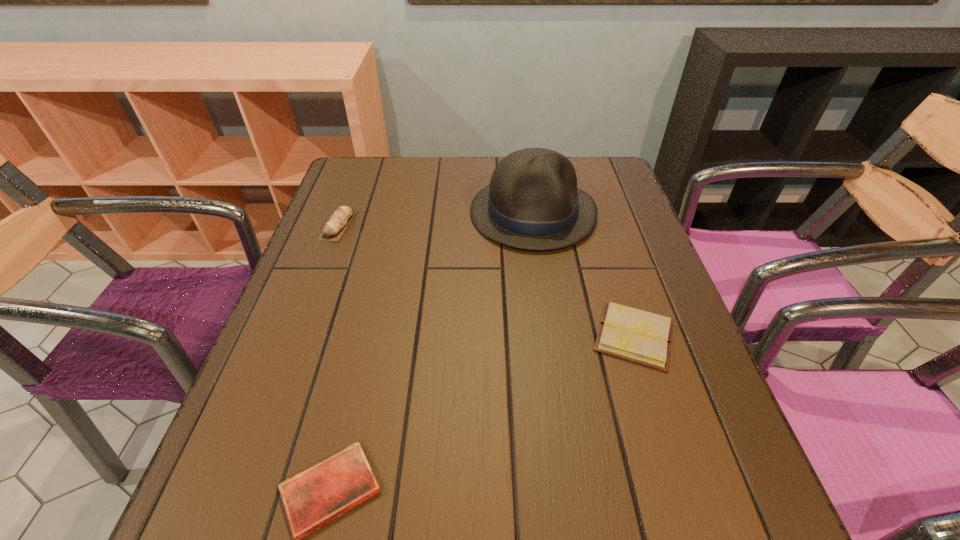
In order to click on bowler hat in this screenshot , I will do `click(532, 202)`.

The height and width of the screenshot is (540, 960). I want to click on the leftmost object, so click(x=333, y=230).

This screenshot has height=540, width=960. I want to click on pita bread, so click(333, 230).

In order to click on the second nearest object in this screenshot , I will do `click(635, 335)`.

Where is `the right diary`? This screenshot has height=540, width=960. the right diary is located at coordinates tap(635, 335).

You are a GUI agent. You are given a task and a screenshot of the screen. Output one action in this format:
    pyautogui.click(x=<x>, y=<y>)
    Task: Click on the free space located 0.330m on the front-facing side of the tallest object
    
    Given the screenshot: What is the action you would take?
    pyautogui.click(x=557, y=375)

Locate an element on the screen. Image resolution: width=960 pixels, height=540 pixels. free region located 0.130m on the back of the second tallest object is located at coordinates (355, 182).

This screenshot has height=540, width=960. I want to click on vacant area located 0.210m on the left of the right diary, so click(482, 335).

The width and height of the screenshot is (960, 540). In order to click on object at the far edge in this screenshot , I will do `click(532, 202)`.

At what (x,y) coordinates should I click in order to perform the action: click on object that is at the left edge. Please return your answer as a coordinate pair (x, y). The image size is (960, 540). Looking at the image, I should click on (333, 230).